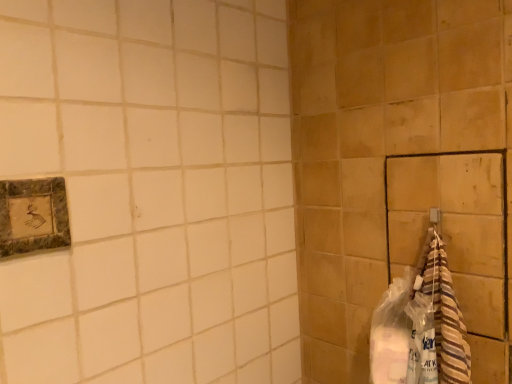
Question: From the image's perspective, does marble-like stone picture frame at upper left appear lower than striped towel at right?

Choices:
 (A) yes
 (B) no

Answer: (B)

Question: From the image's perspective, is marble-like stone picture frame at upper left above striped towel at right?

Choices:
 (A) no
 (B) yes

Answer: (B)

Question: Is striped towel at right located within marble-like stone picture frame at upper left?

Choices:
 (A) yes
 (B) no

Answer: (B)

Question: From a real-world perspective, does marble-like stone picture frame at upper left stand above striped towel at right?

Choices:
 (A) no
 (B) yes

Answer: (B)

Question: Is marble-like stone picture frame at upper left aimed at striped towel at right?

Choices:
 (A) yes
 (B) no

Answer: (B)

Question: From a real-world perspective, is marble-like stone picture frame at upper left under striped towel at right?

Choices:
 (A) no
 (B) yes

Answer: (A)

Question: Does striped towel at right have a larger size compared to marble-like stone picture frame at upper left?

Choices:
 (A) yes
 (B) no

Answer: (A)

Question: Is marble-like stone picture frame at upper left surrounded by striped towel at right?

Choices:
 (A) yes
 (B) no

Answer: (B)

Question: Is marble-like stone picture frame at upper left at the back of striped towel at right?

Choices:
 (A) no
 (B) yes

Answer: (A)

Question: Is striped towel at right at the left side of marble-like stone picture frame at upper left?

Choices:
 (A) no
 (B) yes

Answer: (A)

Question: From the image's perspective, is striped towel at right located above marble-like stone picture frame at upper left?

Choices:
 (A) yes
 (B) no

Answer: (B)

Question: Is striped towel at right with marble-like stone picture frame at upper left?

Choices:
 (A) yes
 (B) no

Answer: (B)

Question: Based on their sizes in the image, would you say marble-like stone picture frame at upper left is bigger or smaller than striped towel at right?

Choices:
 (A) small
 (B) big

Answer: (A)